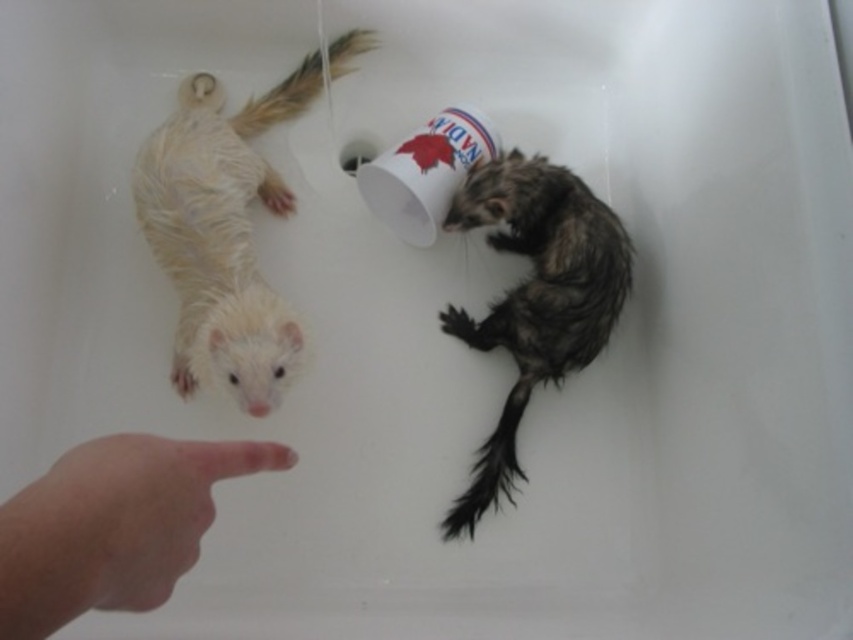
Who is higher up, white paper cup at upper center or black fuzzy tail at lower center?

white paper cup at upper center is above.

Does point (418, 225) come behind point (468, 506)?

Yes.

The height and width of the screenshot is (640, 853). I want to click on white paper cup at upper center, so click(425, 172).

This screenshot has height=640, width=853. Describe the element at coordinates (535, 296) in the screenshot. I see `dark brown fur ferret at right` at that location.

Which is more to the right, dark brown fur ferret at right or white paper cup at upper center?

From the viewer's perspective, dark brown fur ferret at right appears more on the right side.

Who is more forward, [582,348] or [444,124]?

Point [582,348] is more forward.

Find the location of a particular element. The image size is (853, 640). dark brown fur ferret at right is located at coordinates (535, 296).

At what (x,y) coordinates should I click in order to perform the action: click on flesh-toned skin at lower left. Please return your answer as a coordinate pair (x, y). Looking at the image, I should click on (113, 525).

Is point (224, 476) farther from camera compared to point (311, 92)?

That is False.

This screenshot has height=640, width=853. Identify the location of flesh-toned skin at lower left. [x=113, y=525].